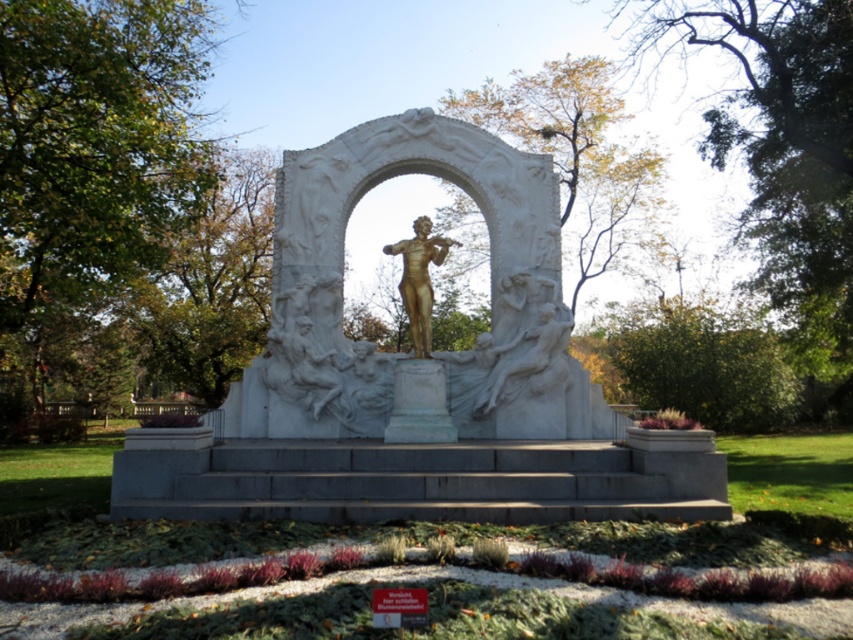
Can you confirm if white marble statue at center is taller than gold statue at center?

No.

Is point (483, 168) less distant than point (438, 221)?

Yes, point (483, 168) is in front of point (438, 221).

Where is `white marble statue at center`? white marble statue at center is located at coordinates (438, 352).

Is the position of gold statue at center less distant than that of gold polished statue at center?

No, it is not.

Which is in front, point (454, 317) or point (424, 285)?

Point (424, 285) is in front.

Where is `gold statue at center`? gold statue at center is located at coordinates (457, 275).

Which is more to the left, white marble statue at center or gold polished statue at center?

white marble statue at center

Is point (323, 145) positioned before point (416, 236)?

No, (323, 145) is further to viewer.

Does point (457, 136) lie behind point (416, 289)?

That is True.

The height and width of the screenshot is (640, 853). I want to click on white marble statue at center, so click(x=438, y=352).